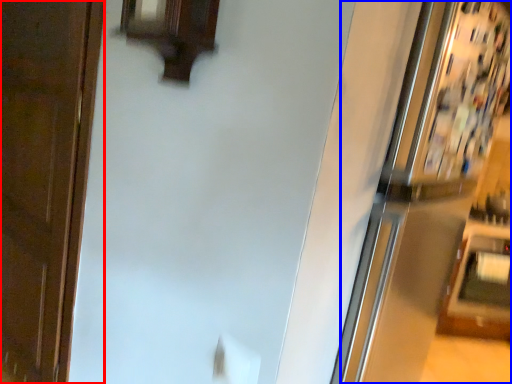
Question: Which of the following is the farthest to the observer, door (highlighted by a red box) or fridge (highlighted by a blue box)?

Choices:
 (A) door
 (B) fridge

Answer: (A)